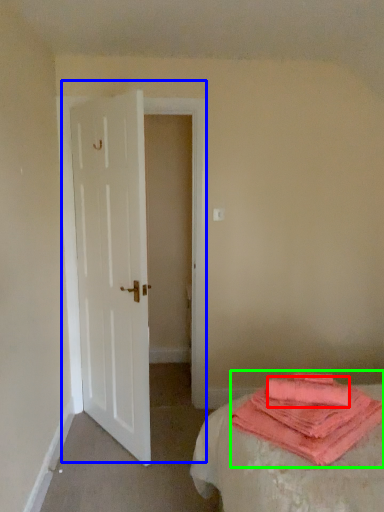
Question: Which object is the closest to the beach towel (highlighted by a red box)? Choose among these: door (highlighted by a blue box) or cloth (highlighted by a green box).

Choices:
 (A) door
 (B) cloth

Answer: (B)